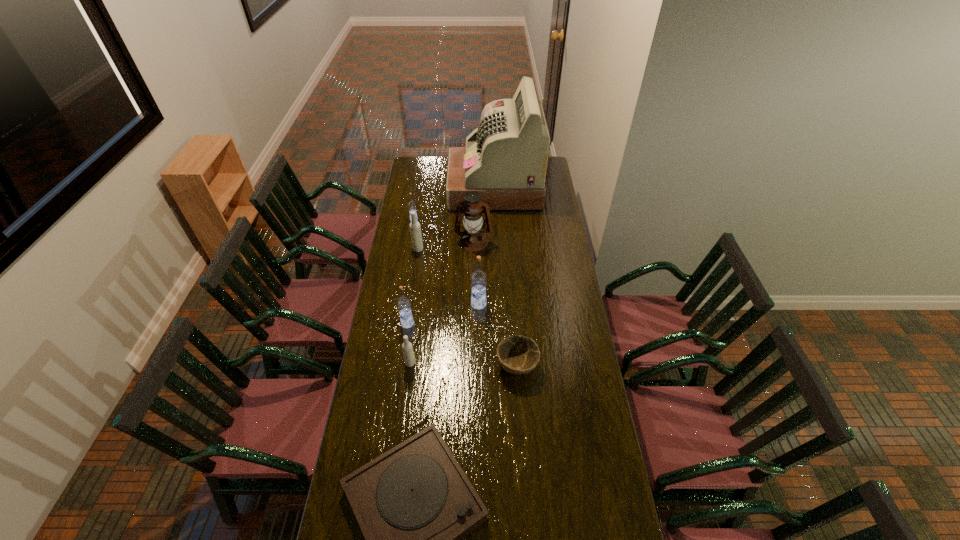
Identify the location of free space between the fourth farthest vodka and the bowl. (463, 345).

You are a GUI agent. You are given a task and a screenshot of the screen. Output one action in this format:
    pyautogui.click(x=<x>, y=<y>)
    Task: Click on the vacant region between the farthest blue vodka and the second shortest object
    The image size is (960, 540).
    Given the screenshot: What is the action you would take?
    pyautogui.click(x=466, y=293)

You are a GUI agent. You are given a task and a screenshot of the screen. Output one action in this format:
    pyautogui.click(x=<x>, y=<y>)
    Task: Click on the vacant space in between the fourth nearest vodka and the second smallest blue vodka
    The width and height of the screenshot is (960, 540).
    Given the screenshot: What is the action you would take?
    pyautogui.click(x=413, y=286)

Locate an element on the screen. empty location between the farthest vodka and the bowl is located at coordinates (466, 293).

The image size is (960, 540). I want to click on unoccupied position between the nearest vodka and the fifth nearest object, so click(x=444, y=334).

Find the location of a particular element. The height and width of the screenshot is (540, 960). vacant area that lies between the nearest vodka and the eighth tallest object is located at coordinates (x=464, y=364).

This screenshot has height=540, width=960. What are the coordinates of `vacant space that's between the third nearest vodka and the second smallest blue vodka` in the screenshot? It's located at (444, 314).

What are the coordinates of `object that ranks as the third closest to the third tallest object` in the screenshot? It's located at (473, 238).

Identify the location of object that is the eighth closest one to the second shortest object. (411, 205).

Identify the location of vodka identified as the closest to the cash register. The width and height of the screenshot is (960, 540). (411, 205).